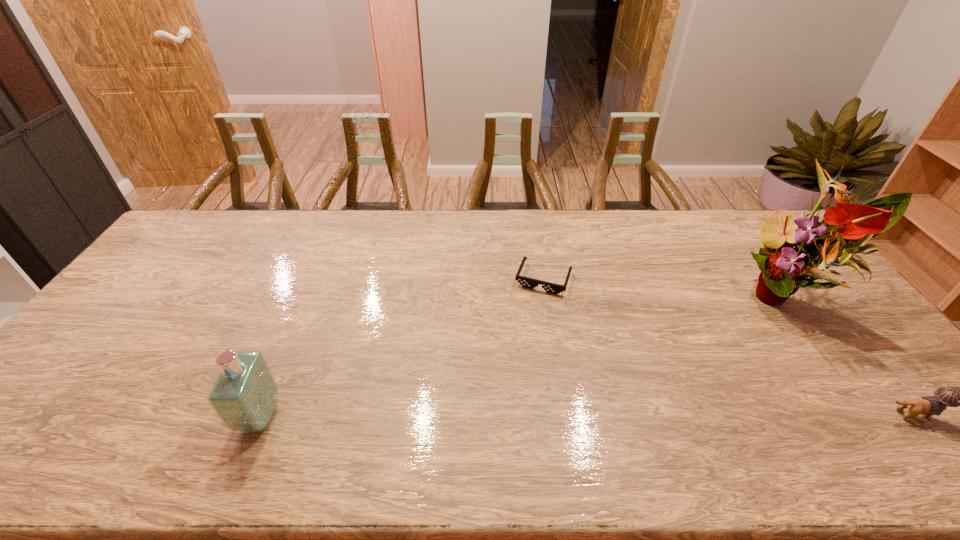
Where is `free spot on the desktop that is between the leftmost object and the kitten and is positioned on the front-facing side of the shortest object`? The image size is (960, 540). free spot on the desktop that is between the leftmost object and the kitten and is positioned on the front-facing side of the shortest object is located at coordinates (494, 416).

Image resolution: width=960 pixels, height=540 pixels. What are the coordinates of `free space on the desktop that is between the third shortest object and the third tallest object and is positioned on the front-facing side of the tallest object` in the screenshot? It's located at (664, 415).